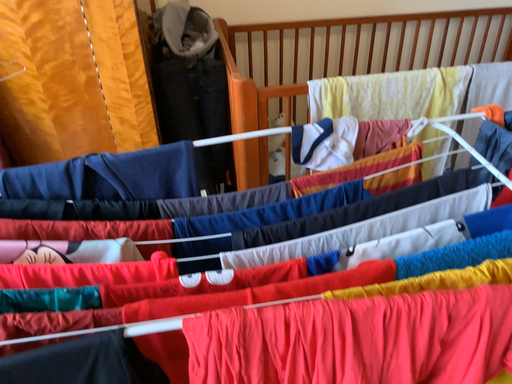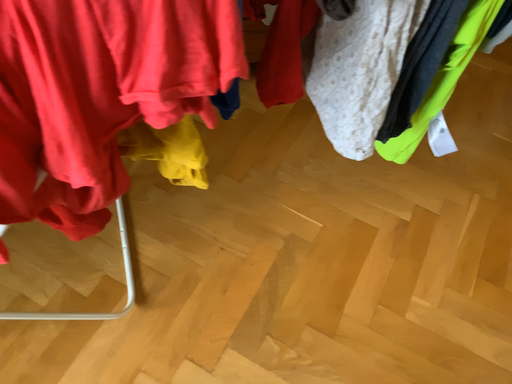
Question: Which way did the camera rotate in the video?

Choices:
 (A) rotated right
 (B) rotated left

Answer: (A)